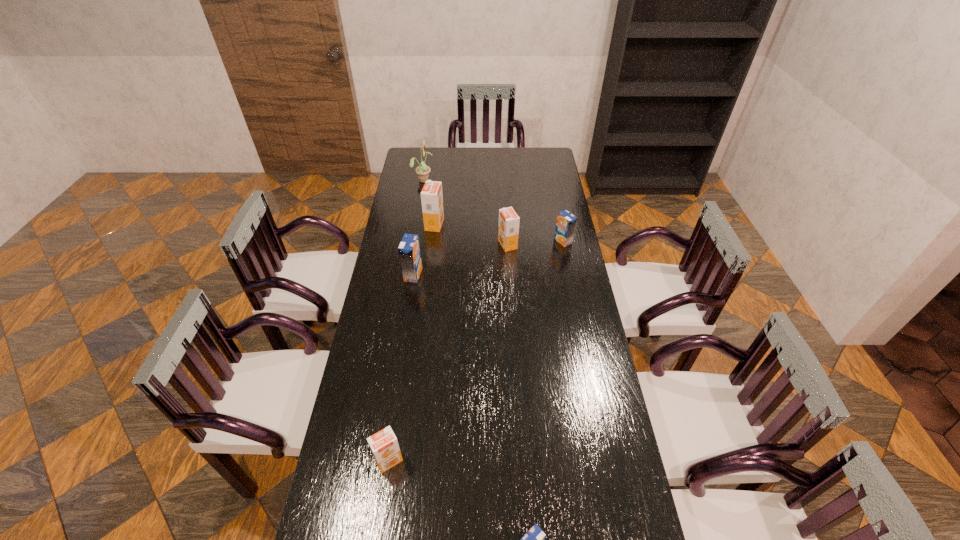
At what (x,y) coordinates should I click in order to perform the action: click on object that stands as the sixth closest to the second nearest orange_juice. Please return your answer as a coordinate pair (x, y). The height and width of the screenshot is (540, 960). Looking at the image, I should click on (422, 170).

At what (x,y) coordinates should I click in order to perform the action: click on orange_juice that is the third closest to the nearest blue orange_juice. Please return your answer as a coordinate pair (x, y). Looking at the image, I should click on (508, 227).

Where is `orange_juice that stands as the second closest to the smallest blue orange_juice`? The width and height of the screenshot is (960, 540). orange_juice that stands as the second closest to the smallest blue orange_juice is located at coordinates (409, 249).

This screenshot has height=540, width=960. I want to click on orange orange juice that is the second closest one to the second smallest orange orange juice, so click(384, 446).

Locate an element on the screen. orange orange juice that stands as the second closest to the tallest orange_juice is located at coordinates (384, 446).

The width and height of the screenshot is (960, 540). I want to click on blue orange_juice that is the closest to the leftmost blue orange_juice, so click(x=566, y=222).

I want to click on blue orange_juice identified as the closest to the shortest object, so click(409, 249).

Locate an element on the screen. vacant space that satisfies the following two spatial constraints: 1. on the front-facing side of the sunflower; 2. on the right side of the fifth farthest object is located at coordinates (408, 275).

The width and height of the screenshot is (960, 540). I want to click on vacant point that satisfies the following two spatial constraints: 1. on the back side of the smallest orange orange juice; 2. on the front-facing side of the yellow sunflower, so pos(430,180).

The height and width of the screenshot is (540, 960). I want to click on vacant space that satisfies the following two spatial constraints: 1. on the front-facing side of the yellow sunflower; 2. on the right side of the fifth farthest orange_juice, so click(x=377, y=460).